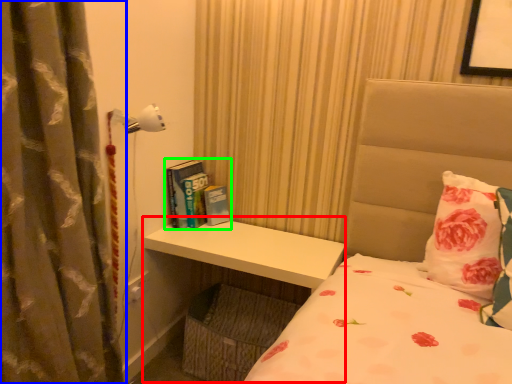
Question: Based on their relative distances, which object is farther from table (highlighted by a red box)? Choose from curtain (highlighted by a blue box) and book (highlighted by a green box).

Choices:
 (A) curtain
 (B) book

Answer: (A)